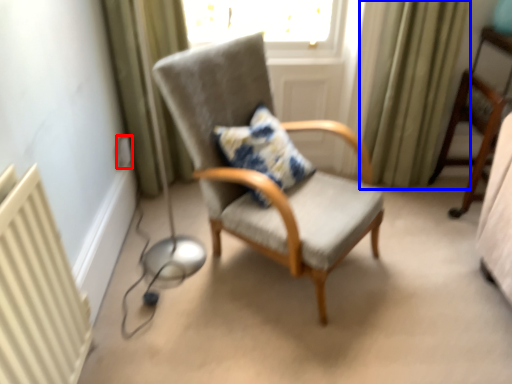
Question: Which object is further to the camera taking this photo, electric outlet (highlighted by a red box) or curtain (highlighted by a blue box)?

Choices:
 (A) electric outlet
 (B) curtain

Answer: (A)